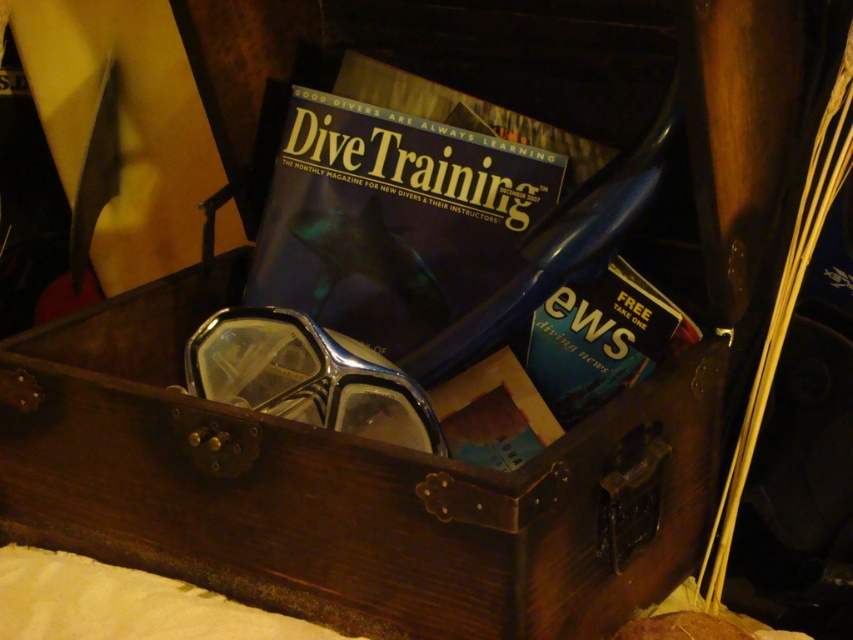
Question: Does blue paper at center appear over blue matte magazine at upper center?

Choices:
 (A) yes
 (B) no

Answer: (B)

Question: Which point is farther from the camera taking this photo?

Choices:
 (A) (641, 305)
 (B) (252, 312)
 (C) (578, 161)
 (D) (381, 108)

Answer: (D)

Question: Is clear plastic goggles at center behind blue paper at center?

Choices:
 (A) no
 (B) yes

Answer: (A)

Question: Can you confirm if blue glossy magazine at center is positioned below blue matte magazine at upper center?

Choices:
 (A) yes
 (B) no

Answer: (A)

Question: Among these points, which one is farthest from the camera?

Choices:
 (A) (364, 186)
 (B) (552, 150)
 (C) (566, 396)

Answer: (A)

Question: Which point is closer to the camera taking this photo?

Choices:
 (A) pyautogui.click(x=671, y=323)
 (B) pyautogui.click(x=436, y=164)

Answer: (A)